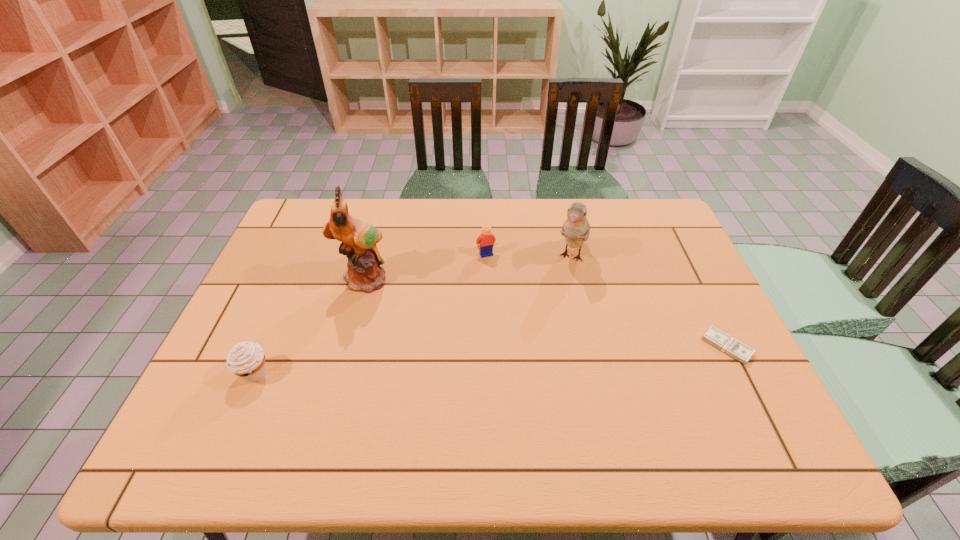
Locate an element on the screen. The width and height of the screenshot is (960, 540). free space that is in between the tallest object and the second object from right to left is located at coordinates (468, 268).

Identify which object is located as the second nearest to the shortest object. Please provide its 2D coordinates. Your answer should be formatted as a tuple, i.e. [(x, y)], where the tuple contains the x and y coordinates of a point satisfying the conditions above.

[(486, 239)]

Locate an element on the screen. object that stands as the fourth closest to the Lego is located at coordinates (246, 359).

Identify the location of blank area in the image that satisfies the following two spatial constraints: 1. on the front side of the rightmost object; 2. on the right side of the second object from right to left. The image size is (960, 540). (592, 347).

Locate an element on the screen. vacant area in the image that satisfies the following two spatial constraints: 1. on the back side of the leftmost object; 2. on the left side of the Lego is located at coordinates (306, 254).